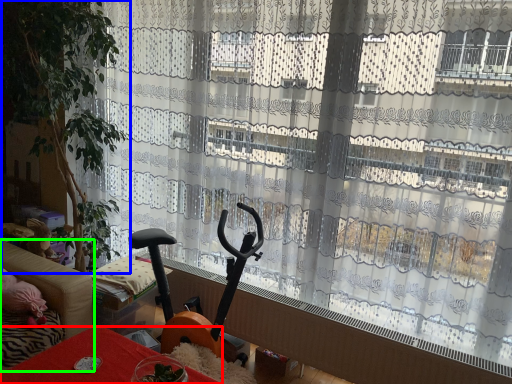
Question: Which object is positioned farthest from furniture (highlighted by a red box)? Select from plant (highlighted by a blue box) and studio couch (highlighted by a green box).

Choices:
 (A) plant
 (B) studio couch

Answer: (A)